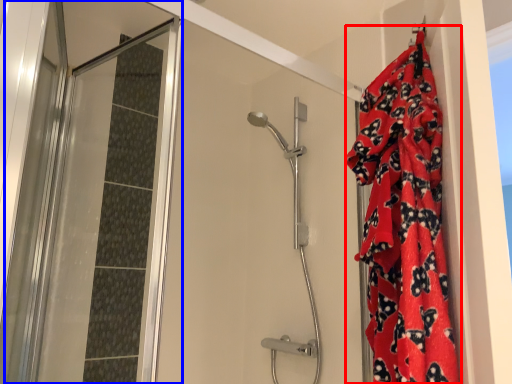
Question: Among these objects, which one is farthest to the camera, blanket (highlighted by a red box) or screen door (highlighted by a blue box)?

Choices:
 (A) blanket
 (B) screen door

Answer: (B)